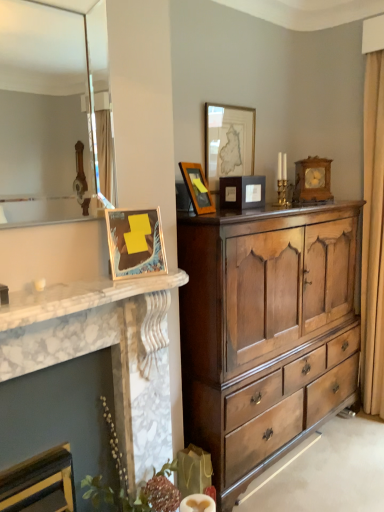
What do you see at coordinates (197, 188) in the screenshot? I see `matte wooden picture frame at upper center, the 2th picture frame viewed from the front` at bounding box center [197, 188].

The width and height of the screenshot is (384, 512). What do you see at coordinates (135, 243) in the screenshot?
I see `metallic gold picture frame at left, which ranks as the first picture frame in left-to-right order` at bounding box center [135, 243].

What do you see at coordinates (312, 181) in the screenshot? The height and width of the screenshot is (512, 384). I see `wooden clock at upper right, arranged as the fifth picture frame when viewed from the left` at bounding box center [312, 181].

What is the approximate height of matte wooden picture frame at upper center, which ranks as the 3th picture frame in right-to-left order?

It is 20.87 inches.

At what (x,y) coordinates should I click in order to perform the action: click on matte wooden picture frame at upper center, the 4th picture frame in the front-to-back sequence. Please return your answer as a coordinate pair (x, y). The width and height of the screenshot is (384, 512). Looking at the image, I should click on (228, 142).

Locate an element on the screen. The width and height of the screenshot is (384, 512). matte wooden picture frame at upper center, the second picture frame from the left is located at coordinates (197, 188).

In terms of size, does white marble fireplace at left appear bigger or smaller than polished wood chest of drawers at center?

Clearly, white marble fireplace at left is smaller in size than polished wood chest of drawers at center.

Which of these two, white marble fireplace at left or polished wood chest of drawers at center, stands taller?

With more height is polished wood chest of drawers at center.

Is white marble fireplace at left surrounding polished wood chest of drawers at center?

Actually, polished wood chest of drawers at center is outside white marble fireplace at left.

Is white marble fireplace at left closer to camera compared to polished wood chest of drawers at center?

Yes, it is in front of polished wood chest of drawers at center.

From a real-world perspective, is wooden clock at upper right, placed as the 1th picture frame when sorted from back to front, above or below white marble fireplace at left?

wooden clock at upper right, placed as the 1th picture frame when sorted from back to front, is above white marble fireplace at left.

Relative to white marble fireplace at left, is wooden clock at upper right, placed as the first picture frame when sorted from right to left, in front or behind?

In the image, wooden clock at upper right, placed as the first picture frame when sorted from right to left, appears behind white marble fireplace at left.

Which of these two, wooden clock at upper right, arranged as the fifth picture frame when viewed from the left, or white marble fireplace at left, stands taller?

wooden clock at upper right, arranged as the fifth picture frame when viewed from the left, is taller.

Considering the sizes of objects matte wooden picture frame at upper center, the 4th picture frame in the front-to-back sequence, and metallic gold picture frame at left, which is the fifth picture frame from back to front, in the image provided, who is taller, matte wooden picture frame at upper center, the 4th picture frame in the front-to-back sequence, or metallic gold picture frame at left, which is the fifth picture frame from back to front,?

matte wooden picture frame at upper center, the 4th picture frame in the front-to-back sequence.

Is matte wooden picture frame at upper center, the second picture frame when ordered from back to front, looking in the opposite direction of metallic gold picture frame at left, which ranks as the first picture frame in left-to-right order?

matte wooden picture frame at upper center, the second picture frame when ordered from back to front, is not turned away from metallic gold picture frame at left, which ranks as the first picture frame in left-to-right order.

Is point (247, 126) positioned after point (115, 215)?

That is True.

Would you consider wooden clock at upper right, arranged as the fifth picture frame when viewed from the left, to be distant from matte wooden picture frame at upper center, the 2th picture frame viewed from the front?

wooden clock at upper right, arranged as the fifth picture frame when viewed from the left, is near matte wooden picture frame at upper center, the 2th picture frame viewed from the front, not far away.

Considering the sizes of wooden clock at upper right, placed as the 1th picture frame when sorted from back to front, and matte wooden picture frame at upper center, placed as the fourth picture frame when sorted from right to left, in the image, is wooden clock at upper right, placed as the 1th picture frame when sorted from back to front, bigger or smaller than matte wooden picture frame at upper center, placed as the fourth picture frame when sorted from right to left,?

In the image, wooden clock at upper right, placed as the 1th picture frame when sorted from back to front, appears to be larger than matte wooden picture frame at upper center, placed as the fourth picture frame when sorted from right to left.

Does wooden clock at upper right, arranged as the fifth picture frame when viewed from the left, turn towards matte wooden picture frame at upper center, the 2th picture frame viewed from the front?

No, wooden clock at upper right, arranged as the fifth picture frame when viewed from the left, is not facing towards matte wooden picture frame at upper center, the 2th picture frame viewed from the front.

Would you say wooden clock at upper right, arranged as the fifth picture frame when viewed from the left, is outside matte wooden picture frame at upper center, placed as the fourth picture frame when sorted from right to left?

That's correct, wooden clock at upper right, arranged as the fifth picture frame when viewed from the left, is outside of matte wooden picture frame at upper center, placed as the fourth picture frame when sorted from right to left.

Is matte wooden picture frame at center, the third picture frame from the front, bigger than metallic gold picture frame at left, which ranks as the 1th picture frame in front-to-back order?

Yes, matte wooden picture frame at center, the third picture frame from the front, is bigger than metallic gold picture frame at left, which ranks as the 1th picture frame in front-to-back order.

Is point (231, 193) behind point (137, 233)?

Yes, it is behind point (137, 233).

Does matte wooden picture frame at upper center, placed as the fourth picture frame when sorted from right to left, have a lesser height compared to matte wooden picture frame at upper center, the 4th picture frame in the front-to-back sequence?

Correct, matte wooden picture frame at upper center, placed as the fourth picture frame when sorted from right to left, is not as tall as matte wooden picture frame at upper center, the 4th picture frame in the front-to-back sequence.

Is matte wooden picture frame at upper center, the fourth picture frame viewed from the back, placed right next to matte wooden picture frame at upper center, which ranks as the 3th picture frame in right-to-left order?

No, matte wooden picture frame at upper center, the fourth picture frame viewed from the back, is not making contact with matte wooden picture frame at upper center, which ranks as the 3th picture frame in right-to-left order.

How distant is matte wooden picture frame at upper center, the second picture frame from the left, from matte wooden picture frame at upper center, the 4th picture frame in the front-to-back sequence?

20.78 inches.

Which object is positioned more to the left, matte wooden picture frame at upper center, the fourth picture frame viewed from the back, or matte wooden picture frame at upper center, which ranks as the 3th picture frame in right-to-left order?

matte wooden picture frame at upper center, the fourth picture frame viewed from the back, is more to the left.

Which of these two, metallic gold picture frame at left, which ranks as the first picture frame in left-to-right order, or white marble fireplace at left, is wider?

white marble fireplace at left.

From a real-world perspective, is metallic gold picture frame at left, which is the fifth picture frame from back to front, positioned over white marble fireplace at left based on gravity?

Yes, from a real-world perspective, metallic gold picture frame at left, which is the fifth picture frame from back to front, is over white marble fireplace at left

Is metallic gold picture frame at left, which ranks as the first picture frame in left-to-right order, positioned far away from white marble fireplace at left?

metallic gold picture frame at left, which ranks as the first picture frame in left-to-right order, is near white marble fireplace at left, not far away.

Is metallic gold picture frame at left, which ranks as the first picture frame in left-to-right order, positioned with its back to white marble fireplace at left?

No, metallic gold picture frame at left, which ranks as the first picture frame in left-to-right order, is not facing away from white marble fireplace at left.

Where is `countertop located above the polished wood chest of drawers at center (from a real-world perspective)`? countertop located above the polished wood chest of drawers at center (from a real-world perspective) is located at coordinates (79, 297).

From the image's perspective, count 4th picture frames upward from the white marble fireplace at left and point to it. Please provide its 2D coordinates.

[(312, 181)]

Considering their positions, is white marble fireplace at left positioned further to polished wood chest of drawers at center than matte wooden picture frame at center, which is the 2th picture frame from right to left?

matte wooden picture frame at center, which is the 2th picture frame from right to left, lies further to polished wood chest of drawers at center than the other object.

Which object lies nearer to the anchor point wooden clock at upper right, the 5th picture frame viewed from the front, matte wooden picture frame at upper center, the second picture frame when ordered from back to front, or polished wood chest of drawers at center?

matte wooden picture frame at upper center, the second picture frame when ordered from back to front, is closer to wooden clock at upper right, the 5th picture frame viewed from the front.

Estimate the real-world distances between objects in this image. Which object is further from wooden clock at upper right, arranged as the fifth picture frame when viewed from the left, polished wood chest of drawers at center or matte glass mirror at upper left?

matte glass mirror at upper left is further to wooden clock at upper right, arranged as the fifth picture frame when viewed from the left.

Estimate the real-world distances between objects in this image. Which object is further from matte glass mirror at upper left, wooden clock at upper right, placed as the first picture frame when sorted from right to left, or metallic gold picture frame at left, which ranks as the 5th picture frame in right-to-left order?

Based on the image, metallic gold picture frame at left, which ranks as the 5th picture frame in right-to-left order, appears to be further to matte glass mirror at upper left.

Which object lies further to the anchor point wooden clock at upper right, placed as the 1th picture frame when sorted from back to front, polished wood chest of drawers at center or white marble fireplace at left?

white marble fireplace at left.

Looking at the image, which one is located further to matte glass mirror at upper left, matte wooden picture frame at center, the third picture frame from the front, or polished wood chest of drawers at center?

matte wooden picture frame at center, the third picture frame from the front.

Estimate the real-world distances between objects in this image. Which object is further from polished wood chest of drawers at center, white marble fireplace at left or matte wooden picture frame at center, the third picture frame from the front?

The object further to polished wood chest of drawers at center is white marble fireplace at left.

When comparing their distances from metallic gold picture frame at left, which ranks as the 1th picture frame in front-to-back order, does matte wooden picture frame at upper center, placed as the fourth picture frame when sorted from right to left, or wooden clock at upper right, the 5th picture frame viewed from the front, seem closer?

matte wooden picture frame at upper center, placed as the fourth picture frame when sorted from right to left, lies closer to metallic gold picture frame at left, which ranks as the 1th picture frame in front-to-back order, than the other object.

The image size is (384, 512). Find the location of `picture frame between matte wooden picture frame at upper center, the 2th picture frame viewed from the front, and polished wood chest of drawers at center vertically`. picture frame between matte wooden picture frame at upper center, the 2th picture frame viewed from the front, and polished wood chest of drawers at center vertically is located at coordinates (135, 243).

This screenshot has width=384, height=512. What are the coordinates of `chest of drawers between white marble fireplace at left and wooden clock at upper right, the 5th picture frame viewed from the front, in the front-back direction` in the screenshot? It's located at (265, 332).

What are the coordinates of `picture frame positioned between matte glass mirror at upper left and matte wooden picture frame at upper center, the fourth picture frame viewed from the back, from near to far` in the screenshot? It's located at (135, 243).

Locate an element on the screen. This screenshot has width=384, height=512. countertop between matte wooden picture frame at upper center, the 2th picture frame viewed from the front, and white marble fireplace at left, in the vertical direction is located at coordinates (79, 297).